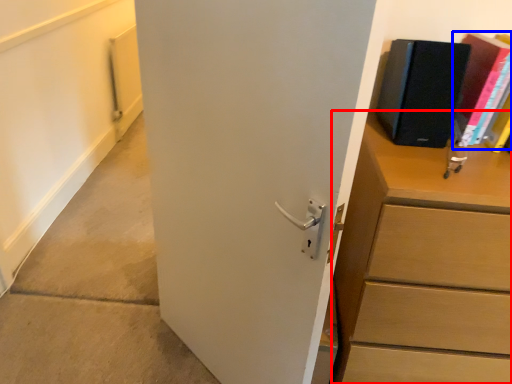
Question: Which point is closer to the camera, chest of drawers (highlighted by a red box) or paperback book (highlighted by a blue box)?

Choices:
 (A) chest of drawers
 (B) paperback book

Answer: (A)